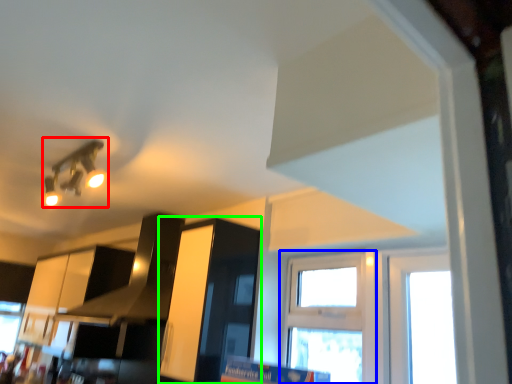
Question: Which object is the closest to the light fixture (highlighted by a red box)? Choose among these: window (highlighted by a blue box) or cabinetry (highlighted by a green box).

Choices:
 (A) window
 (B) cabinetry

Answer: (B)